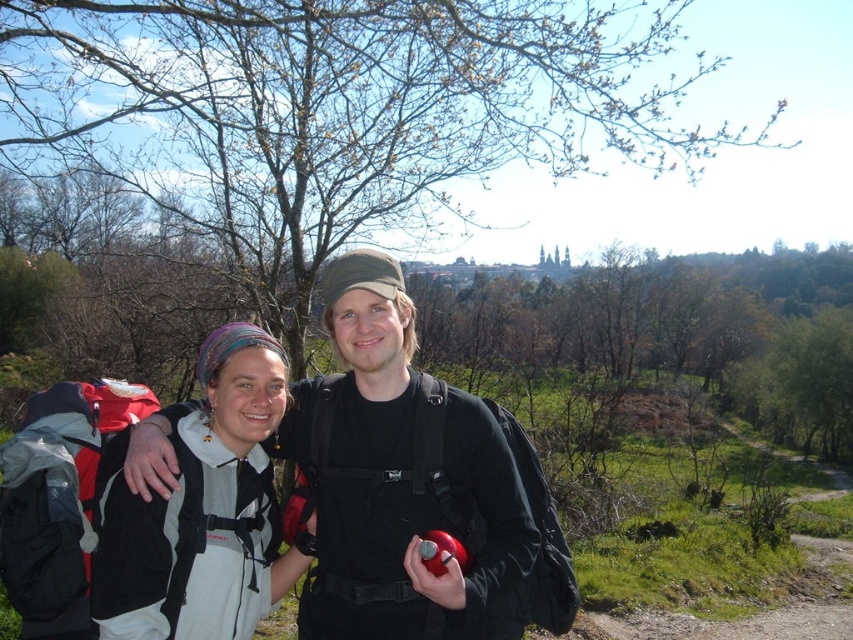
Does matte black backpack at center lie behind white fleece jacket at center?

No, matte black backpack at center is closer to the viewer.

Does matte black backpack at center appear over white fleece jacket at center?

Correct, matte black backpack at center is located above white fleece jacket at center.

Which is behind, point (416, 625) or point (257, 470)?

Positioned behind is point (257, 470).

Image resolution: width=853 pixels, height=640 pixels. I want to click on matte black backpack at center, so click(x=399, y=480).